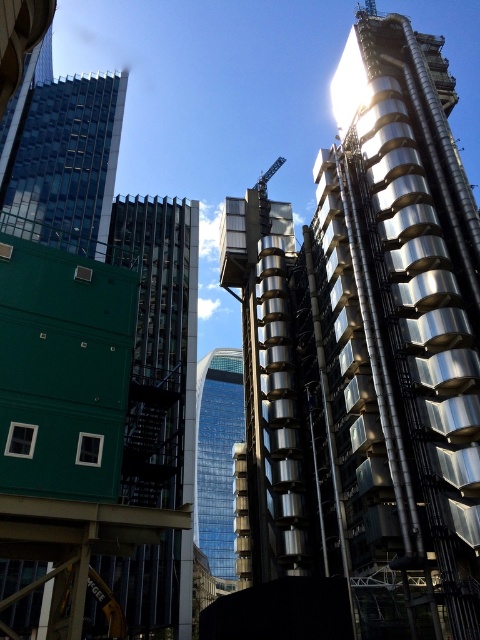
You are an architect analyzing the urban layout. Given the metallic silver building at center and the transparent glass skyscraper at center, which one would require more materials for constructing a similar height building?

The metallic silver building at center requires more materials since it has a larger size compared to the transparent glass skyscraper at center.

You are standing in the urban scene and want to know how far you are from the point at coordinates point (381,316). Can you determine the distance?

The point at coordinates point (381,316) is 54.37 meters away from you.

You are standing in the urban scene and want to take a photo of the metallic silver building at center. If your camera has a maximum focus range of 40 meters, will it be able to capture the building clearly?

The metallic silver building at center is 39.04 meters away from the viewer. Since the camera can focus up to 40 meters, it will be able to capture the building clearly within the focus range.